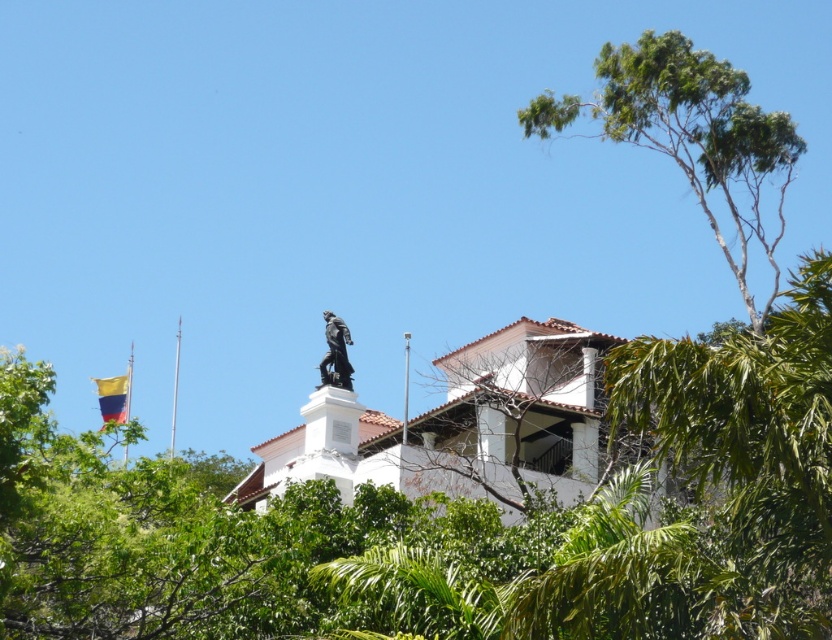
From the picture: Looking at the scene, which object is positioned to the left of the other between the green leafy tree at upper center and the polished bronze statue at upper center?

The polished bronze statue at upper center is to the left of the green leafy tree at upper center.

You are a photographer standing at the base of the flagpole with a yellow, blue, and red flag. You want to capture a photo of the white building with the terracotta roof and the statue on top. However, you notice the green leafy tree at upper right might block part of the building in your shot. Based on the distance provided, can you estimate if the tree will be in front of or behind the building in the photo?

The green leafy tree at upper right is 100.30 meters away from the camera. Since the building is between the photographer and the tree, the tree would be behind the building and not block it.

You are standing at the point marked by the coordinates point (x=692, y=138) in the image. Looking around, you see a white building with a terracotta roof and a statue on top. To your left, there is a flagpole with a flag of yellow, blue, and red stripes. Which direction should you walk to reach the green leafy tree at upper right?

The point (x=692, y=138) indicates the green leafy tree at upper right, so you are already at the location of the green leafy tree at upper right.